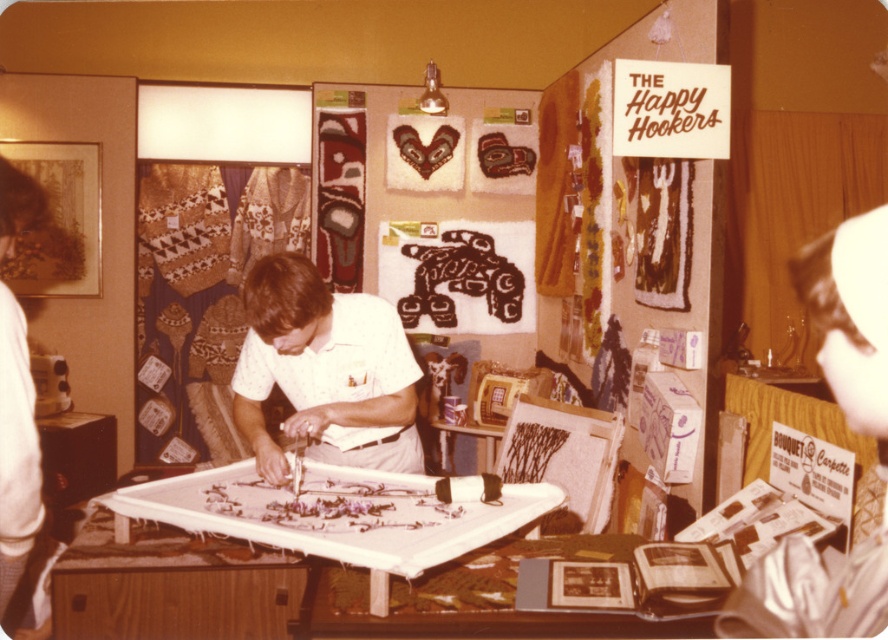
Question: Which point is closer to the camera?

Choices:
 (A) pyautogui.click(x=4, y=310)
 (B) pyautogui.click(x=387, y=384)

Answer: (A)

Question: Among these points, which one is farthest from the camera?

Choices:
 (A) (391, 362)
 (B) (28, 563)

Answer: (A)

Question: Is white cotton pants at lower left bigger than brown woven rug at center?

Choices:
 (A) yes
 (B) no

Answer: (A)

Question: Does white cotton shirt at center have a larger size compared to white cotton pants at lower left?

Choices:
 (A) yes
 (B) no

Answer: (A)

Question: Among these objects, which one is farthest from the camera?

Choices:
 (A) white cotton shirt at center
 (B) brown woven rug at center

Answer: (B)

Question: Can you confirm if white cotton shirt at center is bigger than brown woven rug at center?

Choices:
 (A) yes
 (B) no

Answer: (A)